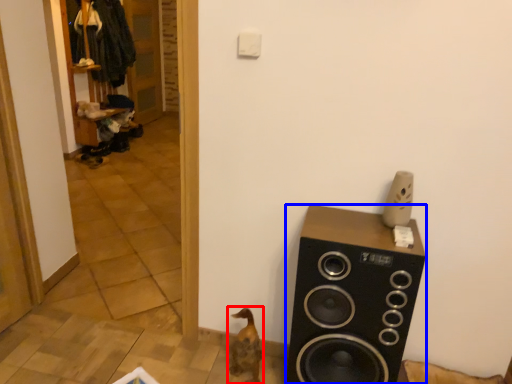
Question: Which object appears farthest to the camera in this image, animal (highlighted by a red box) or speaker (highlighted by a blue box)?

Choices:
 (A) animal
 (B) speaker

Answer: (A)